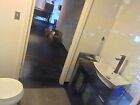
Locate an element on the screen. wall to the right of bathroom is located at coordinates (74, 15).